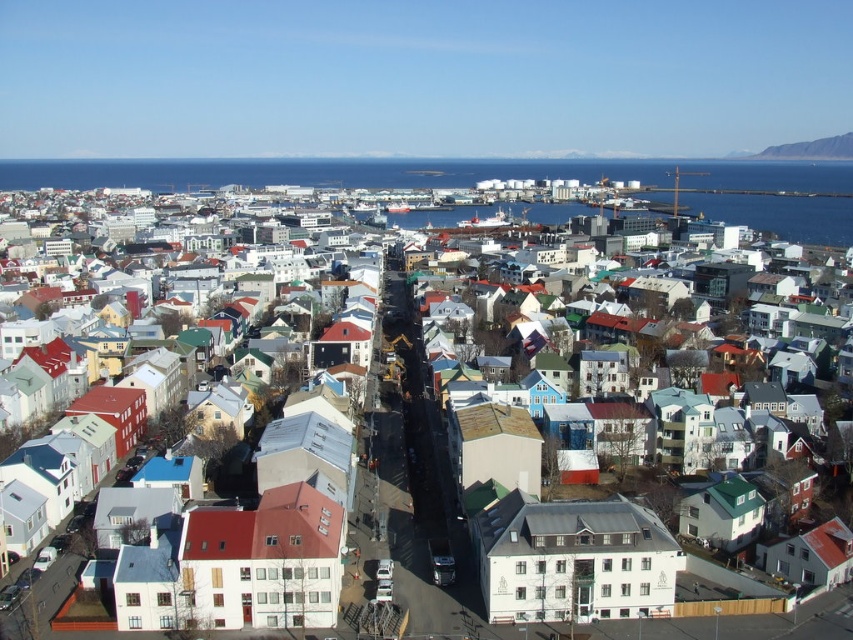
Does rugged rock cliff at upper right appear over white matte building at center?

Correct, rugged rock cliff at upper right is located above white matte building at center.

Is rugged rock cliff at upper right wider than white matte building at center?

Incorrect, rugged rock cliff at upper right's width does not surpass white matte building at center's.

This screenshot has height=640, width=853. Describe the element at coordinates (807, 148) in the screenshot. I see `rugged rock cliff at upper right` at that location.

At what (x,y) coordinates should I click in order to perform the action: click on rugged rock cliff at upper right. Please return your answer as a coordinate pair (x, y). Image resolution: width=853 pixels, height=640 pixels. Looking at the image, I should click on click(807, 148).

Who is positioned more to the right, blue water at upper left or white matte building at center?

From the viewer's perspective, white matte building at center appears more on the right side.

Between point (764, 216) and point (415, 385), which one is positioned behind?

Point (764, 216)

In order to click on blue water at upper left in this screenshot , I will do `click(497, 177)`.

From the picture: Can you confirm if blue water at upper left is taller than rugged rock cliff at upper right?

Indeed, blue water at upper left has a greater height compared to rugged rock cliff at upper right.

Is blue water at upper left below rugged rock cliff at upper right?

Correct, blue water at upper left is located below rugged rock cliff at upper right.

The image size is (853, 640). I want to click on blue water at upper left, so click(x=497, y=177).

The height and width of the screenshot is (640, 853). I want to click on blue water at upper left, so click(x=497, y=177).